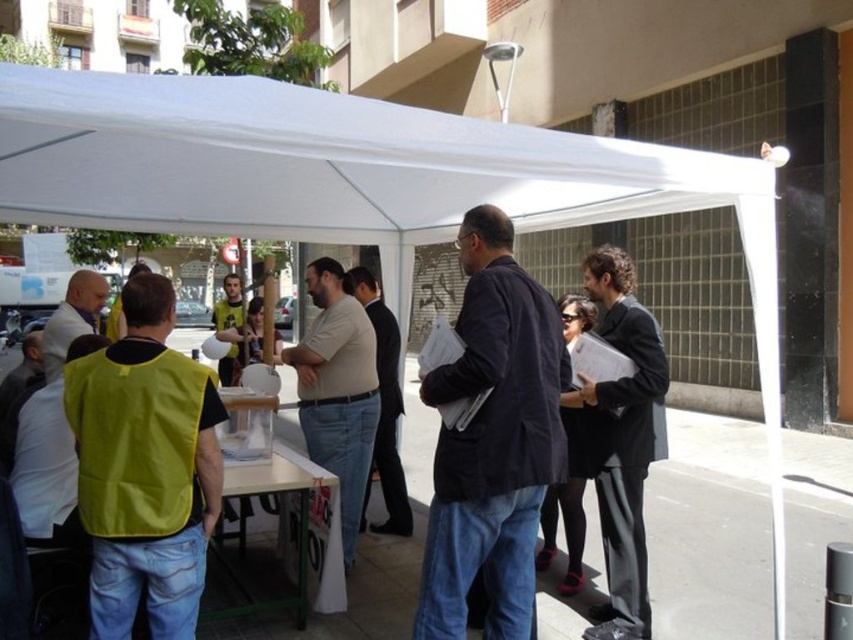
You are a photographer positioned outside the white canopy tent. You want to capture a photo where the yellow fabric vest at center and the matte beige shirt at center are both visible. Which object should you focus on first to ensure both are in frame?

You should focus on the yellow fabric vest at center first because it is located above the matte beige shirt at center, so by centering the vest in your viewfinder, you can adjust the frame to include both objects.